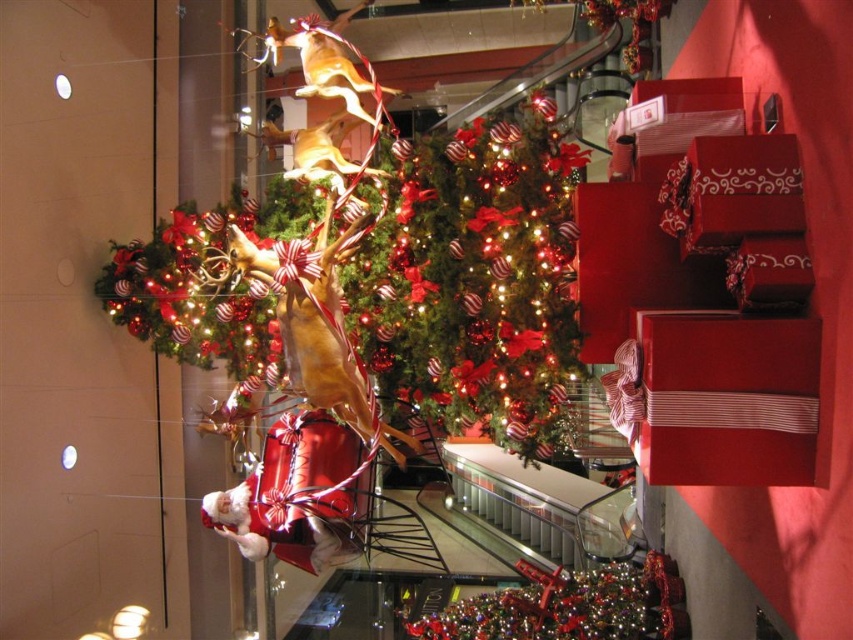
You are a store manager checking the Christmas display. You notice the shiny red gift at center and the shiny metallic ornament at center. Which one is positioned higher in the display?

The shiny red gift at center is positioned higher than the shiny metallic ornament at center.

You are a store manager checking the Christmas display. You need to determine if the shiny red gift at center can be placed under the shiny red christmas tree at center without moving the tree. Can it fit based on their sizes?

The shiny red gift at center is bigger than the shiny red christmas tree at center, so it cannot fit under the tree without moving it.